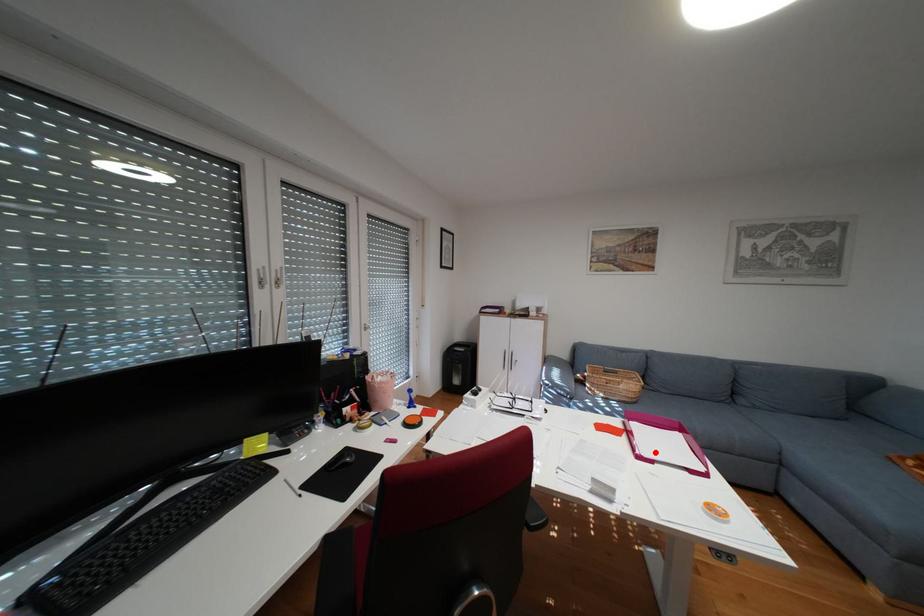
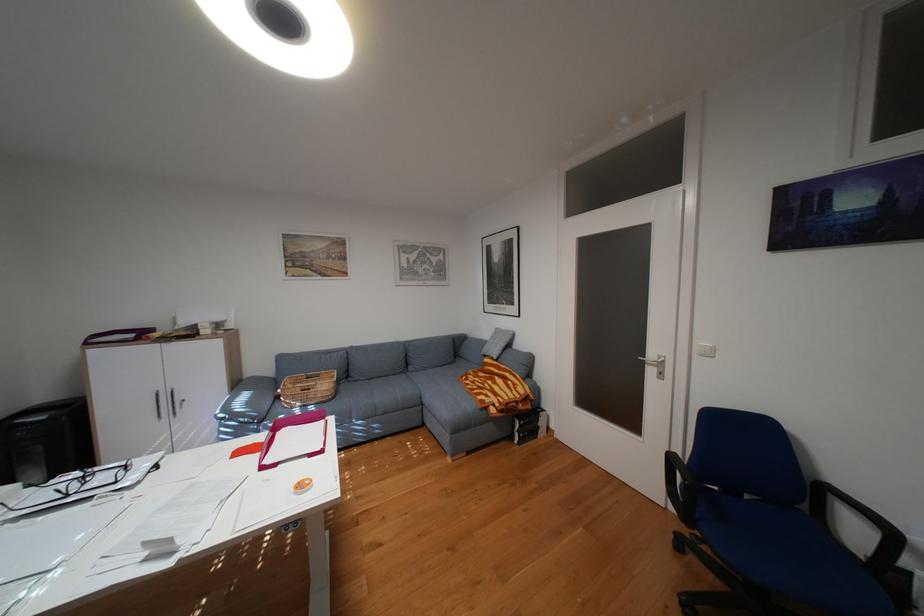
Find the pixel in the second image that matches the highlighted location in the first image.

(280, 460)